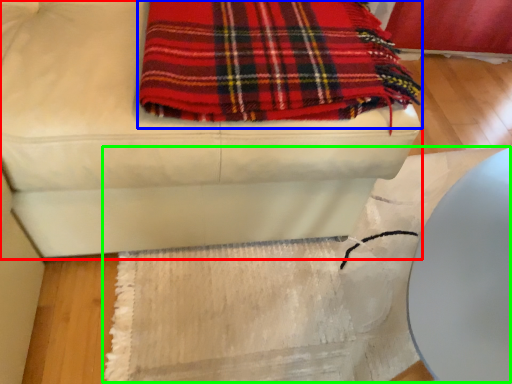
Question: Considering the real-world distances, which object is closest to furniture (highlighted by a red box)? blanket (highlighted by a blue box) or mat (highlighted by a green box).

Choices:
 (A) blanket
 (B) mat

Answer: (A)